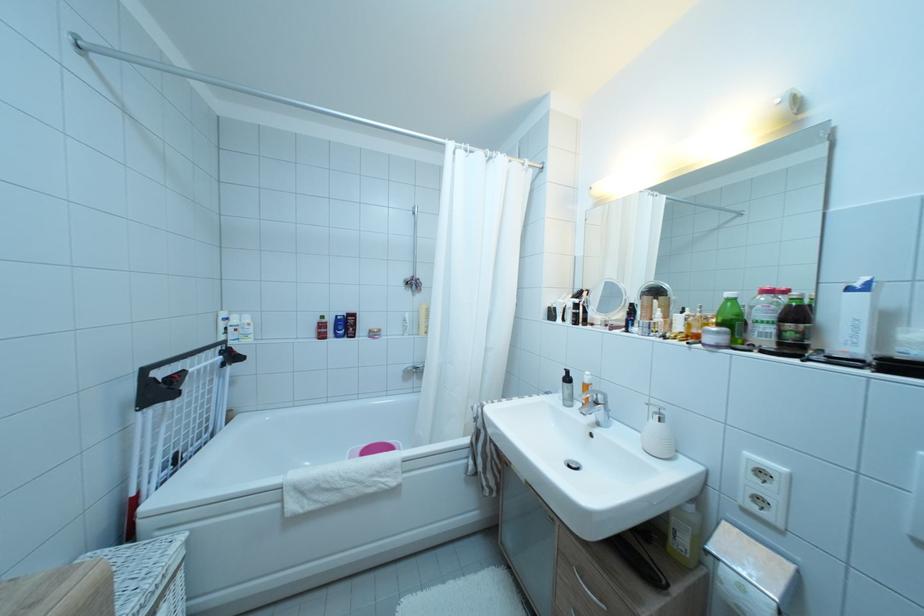
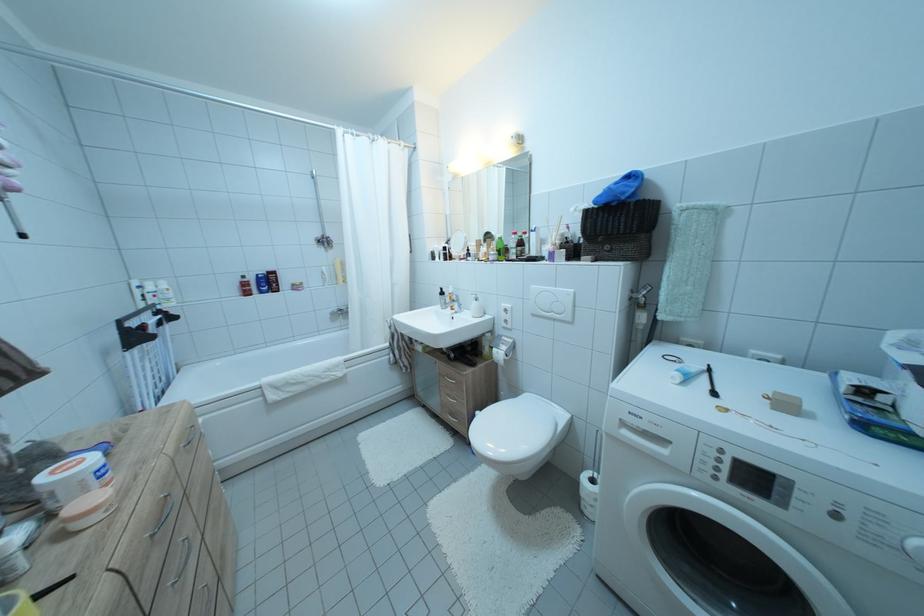
Question: What movement of the cameraman would produce the second image?

Choices:
 (A) Left
 (B) Right
 (C) Forward
 (D) Backward

Answer: (D)